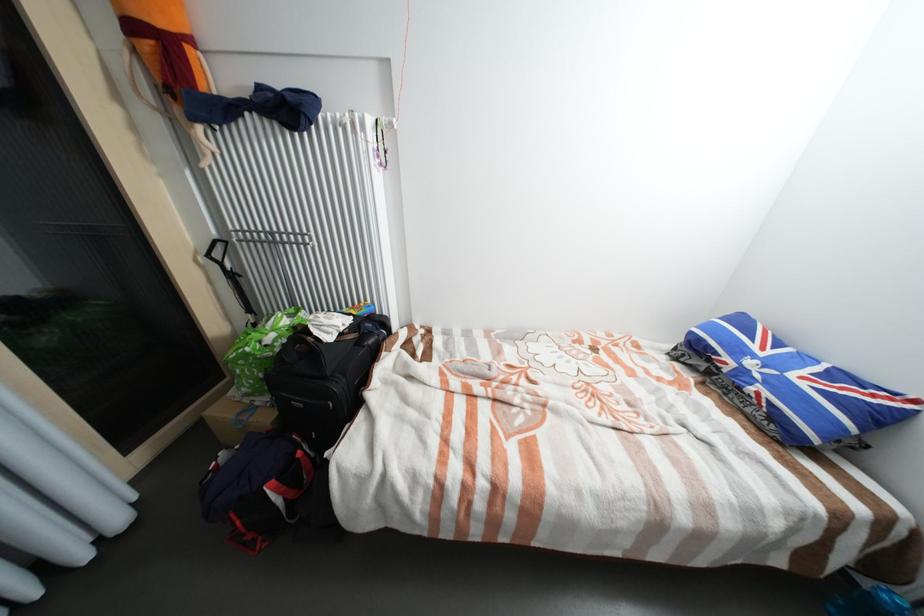
Locate an element on the screen. Image resolution: width=924 pixels, height=616 pixels. black luggage handle is located at coordinates (341, 331).